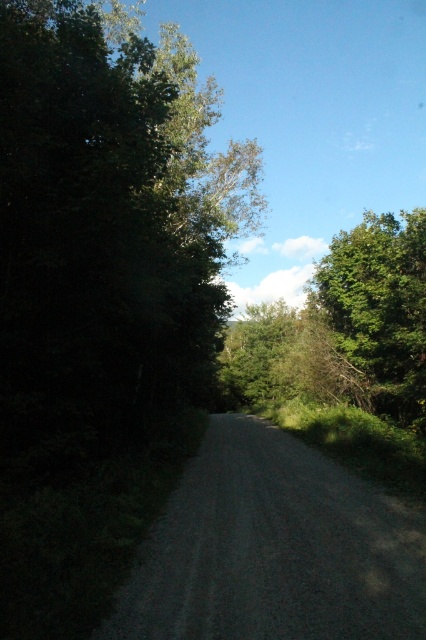
You are a hiker trying to navigate through the forest. You see the gray gravel road at center and the green leafy tree at right. Which one is smaller in size?

The gray gravel road at center is smaller in size compared to the green leafy tree at right.

You are driving a car that is 15 feet long. You see the gray gravel road at center and the green leafy tree at right in the distance. Can your car fit between them without hitting the tree?

The gray gravel road at center and green leafy tree at right are 37.76 feet apart from each other. Since the car is 15 feet long, there is enough space for it to fit between them without hitting the tree.

You are driving a car that is 2 meters wide. You see the gray gravel road at center and the green leafy tree at right. Can your car safely pass through the road between them without hitting the tree?

The gray gravel road at center is in front of the green leafy tree at right, meaning the tree is behind the road. Since the road is at the center and the tree is to the right, the car can safely drive on the road without hitting the tree as there is no obstruction in the path.